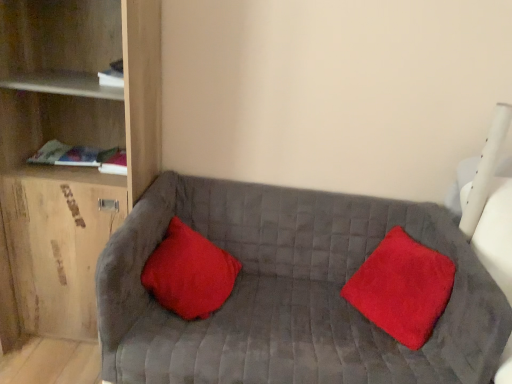
Question: From a real-world perspective, is red velvet pillow at center, acting as the 2th pillow starting from the right, over red plush pillow at center, marked as the first pillow in a right-to-left arrangement?

Choices:
 (A) no
 (B) yes

Answer: (A)

Question: Is red plush pillow at center, marked as the first pillow in a right-to-left arrangement, completely or partially inside red velvet pillow at center, acting as the 2th pillow starting from the right?

Choices:
 (A) yes
 (B) no

Answer: (B)

Question: Considering the relative positions of red velvet pillow at center, acting as the 2th pillow starting from the right, and red plush pillow at center, arranged as the second pillow when viewed from the left, in the image provided, is red velvet pillow at center, acting as the 2th pillow starting from the right, to the left of red plush pillow at center, arranged as the second pillow when viewed from the left, from the viewer's perspective?

Choices:
 (A) yes
 (B) no

Answer: (A)

Question: Can you confirm if red velvet pillow at center, acting as the 2th pillow starting from the right, is smaller than red plush pillow at center, arranged as the second pillow when viewed from the left?

Choices:
 (A) no
 (B) yes

Answer: (B)

Question: Considering the relative positions of red velvet pillow at center, acting as the 2th pillow starting from the right, and red plush pillow at center, arranged as the second pillow when viewed from the left, in the image provided, is red velvet pillow at center, acting as the 2th pillow starting from the right, in front of red plush pillow at center, arranged as the second pillow when viewed from the left,?

Choices:
 (A) no
 (B) yes

Answer: (A)

Question: Does red velvet pillow at center, acting as the 2th pillow starting from the right, lie behind red plush pillow at center, marked as the first pillow in a right-to-left arrangement?

Choices:
 (A) yes
 (B) no

Answer: (A)

Question: From the image's perspective, is velvet gray couch at center located above red velvet pillow at center, which is the first pillow in left-to-right order?

Choices:
 (A) no
 (B) yes

Answer: (A)

Question: Considering the relative sizes of velvet gray couch at center and red velvet pillow at center, acting as the 2th pillow starting from the right, in the image provided, is velvet gray couch at center taller than red velvet pillow at center, acting as the 2th pillow starting from the right,?

Choices:
 (A) yes
 (B) no

Answer: (A)

Question: From a real-world perspective, is velvet gray couch at center on red velvet pillow at center, acting as the 2th pillow starting from the right?

Choices:
 (A) yes
 (B) no

Answer: (B)

Question: Is red velvet pillow at center, which is the first pillow in left-to-right order, inside velvet gray couch at center?

Choices:
 (A) no
 (B) yes

Answer: (B)

Question: From the image's perspective, does velvet gray couch at center appear lower than red velvet pillow at center, acting as the 2th pillow starting from the right?

Choices:
 (A) yes
 (B) no

Answer: (A)

Question: Is velvet gray couch at center not inside red velvet pillow at center, which is the first pillow in left-to-right order?

Choices:
 (A) yes
 (B) no

Answer: (A)

Question: Does red plush pillow at center, arranged as the second pillow when viewed from the left, come behind wooden shelf at left?

Choices:
 (A) no
 (B) yes

Answer: (B)